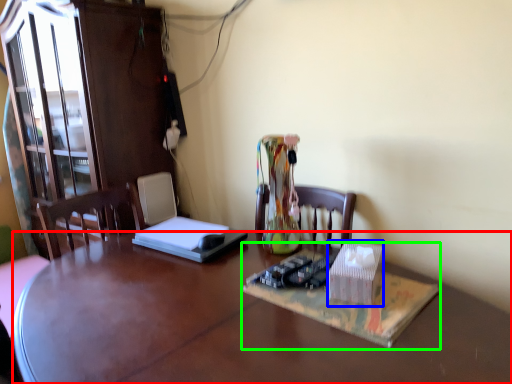
Question: Based on their relative distances, which object is nearer to desk (highlighted by a red box)? Choose from cardboard box (highlighted by a blue box) and book (highlighted by a green box).

Choices:
 (A) cardboard box
 (B) book

Answer: (B)